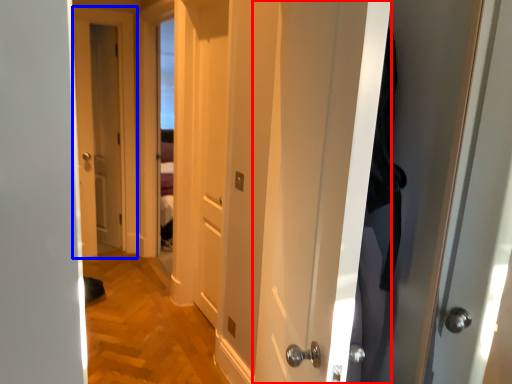
Question: Which of the following is the farthest to the observer, door (highlighted by a red box) or door (highlighted by a blue box)?

Choices:
 (A) door
 (B) door

Answer: (B)